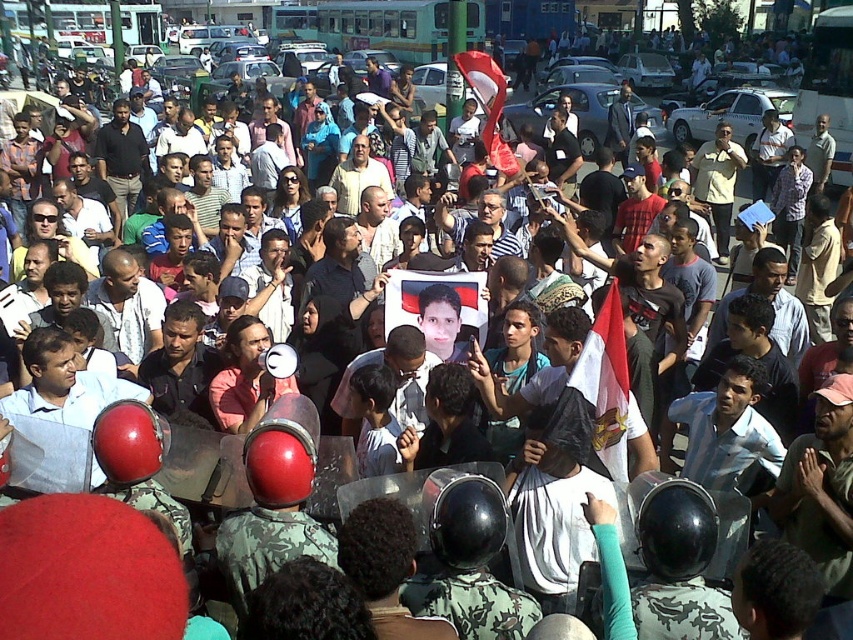
You are a photographer standing in the crowd and want to capture both the white fabric flag at center and the red fabric flag at center in a single photo. Given that your camera has a maximum focus range of 6 feet, will you be able to fit both flags into the frame?

The distance between the white fabric flag at center and the red fabric flag at center is 5.89 feet, which is within the camera maximum focus range of 6 feet. Therefore, you can fit both flags into the frame.

You are organizing a protest and need to display two flags, the white fabric flag at center and the red fabric flag at center, on a stand that can only hold one flag at a time. Based on their widths, which flag should you choose to ensure it is more visible from a distance?

The red fabric flag at center has a greater width than the white fabric flag at center, so it should be chosen for better visibility from a distance.